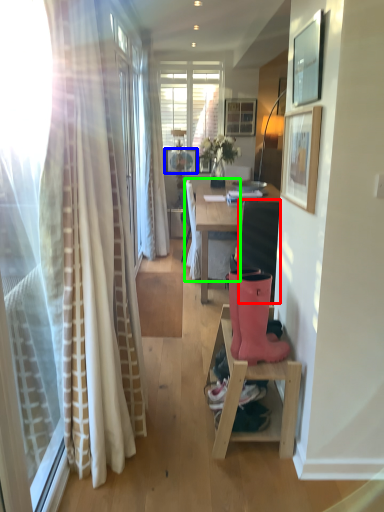
Question: Which object is positioned closest to swivel chair (highlighted by a red box)? Select from picture frame (highlighted by a blue box) and chair (highlighted by a green box).

Choices:
 (A) picture frame
 (B) chair

Answer: (B)